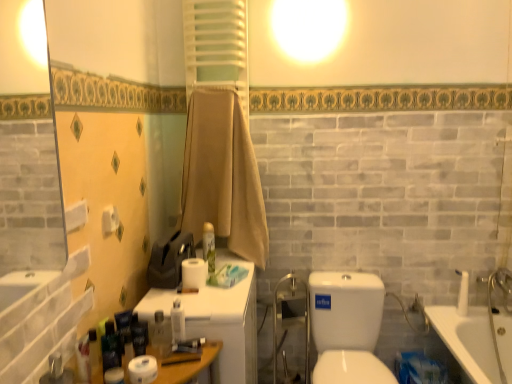
Question: Looking at the image, does white matte toilet paper at center, the 1th toilet paper positioned from the top, seem bigger or smaller compared to white matte toilet paper at lower left, positioned as the first toilet paper in bottom-to-top order?

Choices:
 (A) big
 (B) small

Answer: (A)

Question: From the image's perspective, is white matte toilet paper at center, which is the 2th toilet paper in front-to-back order, positioned above or below white matte toilet paper at lower left, placed as the second toilet paper when sorted from top to bottom?

Choices:
 (A) below
 (B) above

Answer: (B)

Question: Estimate the real-world distances between objects in this image. Which object is closer to the white matte toilet paper at lower left, the second toilet paper positioned from the back?

Choices:
 (A) beige cotton towel at center
 (B) matte green spray can at center, the 1th toiletry when ordered from right to left
 (C) transparent glass shower door at center
 (D) white matte toilet paper at center, the 1th toilet paper positioned from the top
 (E) translucent plastic tube at lower left, arranged as the 4th toiletry when viewed from the back

Answer: (E)

Question: Estimate the real-world distances between objects in this image. Which object is farther from the white matte toilet paper at lower left, arranged as the second toilet paper when viewed from the right?

Choices:
 (A) white matte roll of toilet paper at lower left, the 4th toiletry when ordered from right to left
 (B) white plastic medicine cabinet at center
 (C) translucent plastic bottle at center, which is counted as the fourth toiletry, starting from the left
 (D) white matte toilet paper at center, the 1th toilet paper positioned from the top
 (E) translucent plastic tube at lower left, arranged as the 5th toiletry when viewed from the right

Answer: (D)